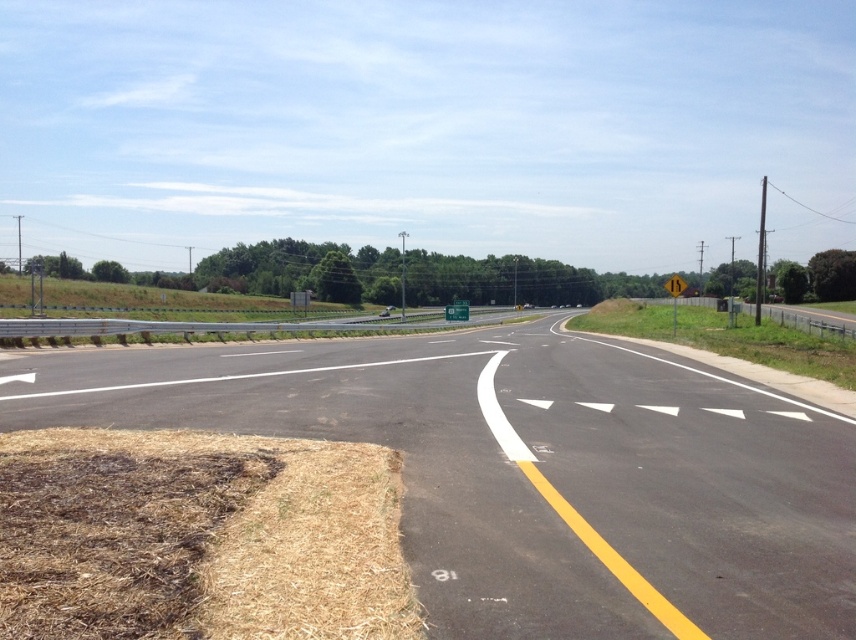
Question: Which object is positioned farthest from the brown dry grass at lower left?

Choices:
 (A) asphalt road at center
 (B) green plastic sign at center
 (C) yellow reflective plastic sign at right

Answer: (B)

Question: Considering the real-world distances, which object is farthest from the yellow reflective plastic sign at right?

Choices:
 (A) brown dry grass at lower left
 (B) asphalt road at center
 (C) green plastic sign at center

Answer: (A)

Question: Among these points, which one is nearest to the camera?

Choices:
 (A) (682, 289)
 (B) (473, 595)

Answer: (B)

Question: Does brown dry grass at lower left have a smaller size compared to green plastic sign at center?

Choices:
 (A) no
 (B) yes

Answer: (B)

Question: Does brown dry grass at lower left have a smaller size compared to yellow reflective plastic sign at right?

Choices:
 (A) no
 (B) yes

Answer: (B)

Question: Can you confirm if brown dry grass at lower left is positioned above green plastic sign at center?

Choices:
 (A) yes
 (B) no

Answer: (B)